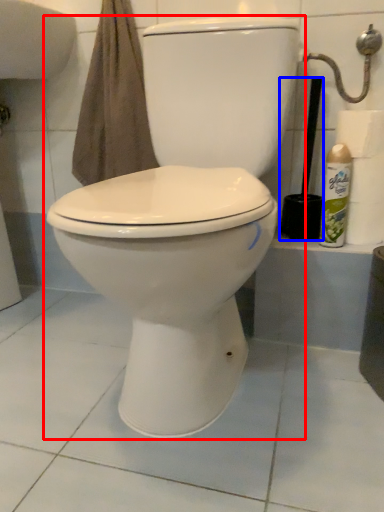
Question: Which point is closer to the camera, toilet (highlighted by a red box) or brush (highlighted by a blue box)?

Choices:
 (A) toilet
 (B) brush

Answer: (A)